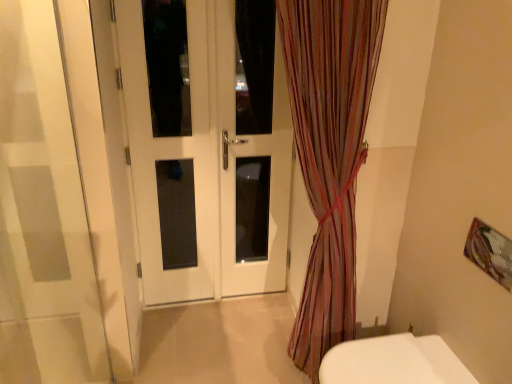
I want to click on blank space to the left of striped sheer curtain at center, so click(x=233, y=354).